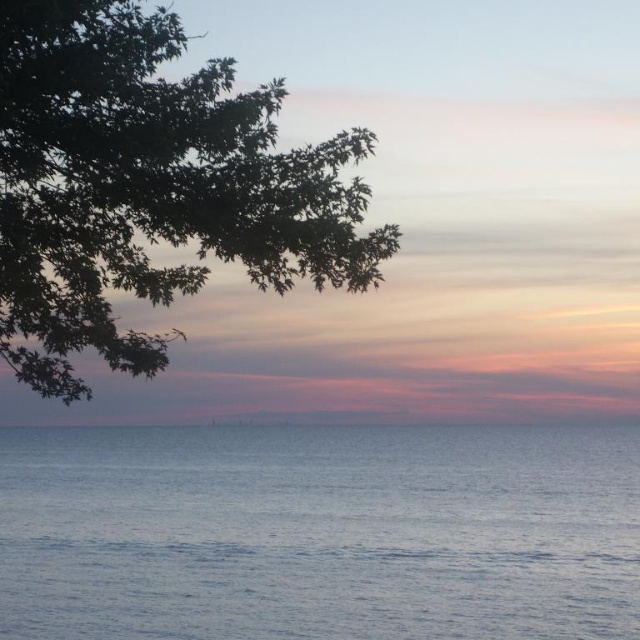
Question: Which point is farther to the camera?

Choices:
 (A) (124, 240)
 (B) (508, 632)

Answer: (B)

Question: Can you confirm if blue smooth water at lower center is wider than green leafy tree at upper left?

Choices:
 (A) no
 (B) yes

Answer: (B)

Question: Among these points, which one is nearest to the camera?

Choices:
 (A) (225, 556)
 (B) (344, 189)

Answer: (B)

Question: Considering the relative positions of blue smooth water at lower center and green leafy tree at upper left in the image provided, where is blue smooth water at lower center located with respect to green leafy tree at upper left?

Choices:
 (A) below
 (B) above

Answer: (A)

Question: From the image, what is the correct spatial relationship of blue smooth water at lower center in relation to green leafy tree at upper left?

Choices:
 (A) above
 (B) below

Answer: (B)